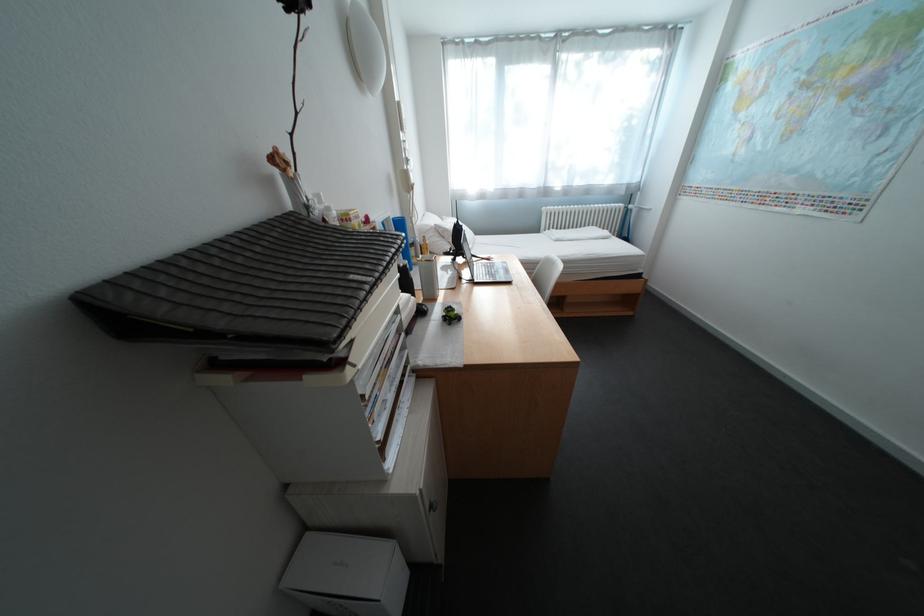
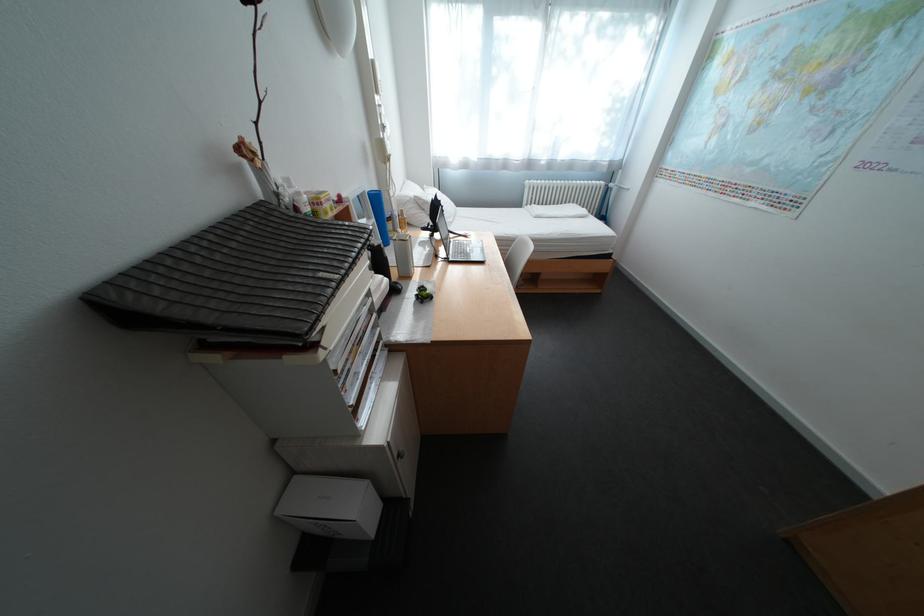
The point at [423,312] is marked in the first image. Where is the corresponding point in the second image?

(395, 292)